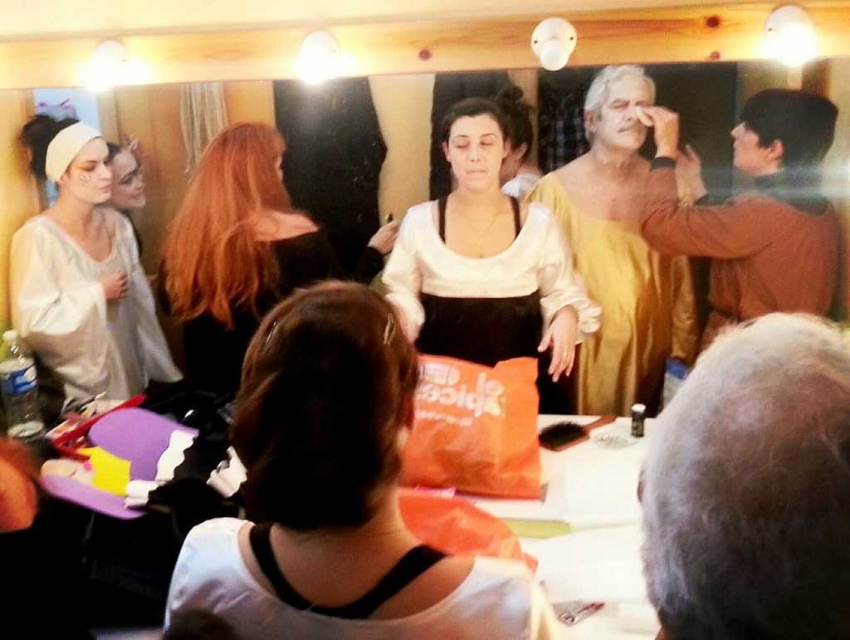
You are a costume assistant in a theater. You need to check the white matte dress at lower center for any stains before the performance. However, the shiny brown hair at center is blocking your view. Can you see the dress clearly?

The white matte dress at lower center is behind the shiny brown hair at center, so you cannot see it clearly without moving the hair.

You are standing in the dressing room and need to reach both the point at coordinates (37, 224) and the point at (591, 616). Which point is closer to you?

The point at coordinates (37, 224) is closer to you because it is further to the viewer than the point at (591, 616).

You are a costume assistant who needs to pack two items, the matte white shirt at center and the black satin dress at center, into a narrow storage box. Based on their dimensions, which item should you place first to ensure both fit properly?

The matte white shirt at center is thinner than the black satin dress at center, so you should place the black satin dress at center first to accommodate its bulkier size before adding the thinner shirt.